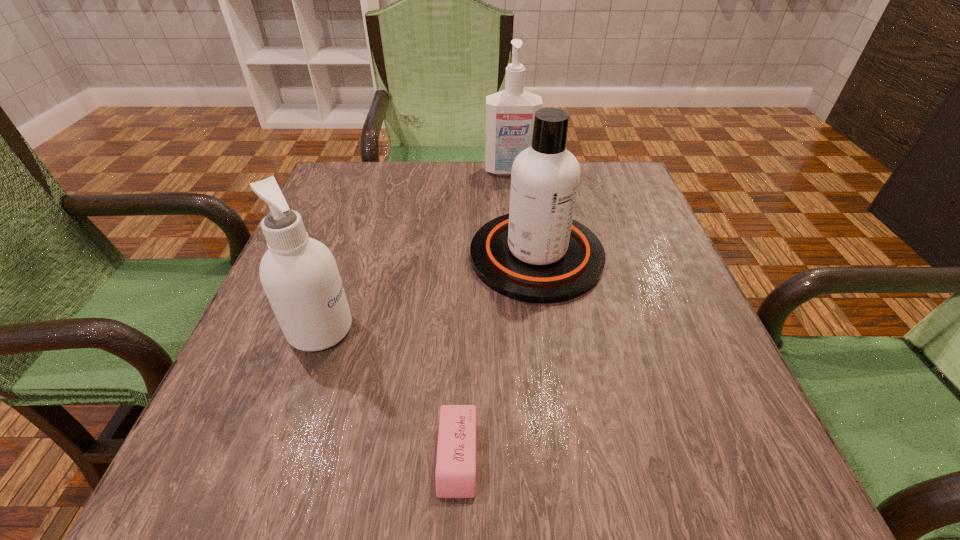
At what (x,y) coordinates should I click in order to perform the action: click on blank area in the image that satisfies the following two spatial constraints: 1. on the front label of the farthest object; 2. on the left side of the second farthest cleansing agent. Please return your answer as a coordinate pair (x, y). This screenshot has width=960, height=540. Looking at the image, I should click on (519, 256).

At what (x,y) coordinates should I click in order to perform the action: click on free space that satisfies the following two spatial constraints: 1. on the front label of the second nearest object; 2. on the left side of the shortest object. Please return your answer as a coordinate pair (x, y). Looking at the image, I should click on [x=276, y=456].

Where is `free spot that satisfies the following two spatial constraints: 1. on the back side of the nearest object; 2. on the front label of the third farthest object`? Image resolution: width=960 pixels, height=540 pixels. free spot that satisfies the following two spatial constraints: 1. on the back side of the nearest object; 2. on the front label of the third farthest object is located at coordinates (463, 329).